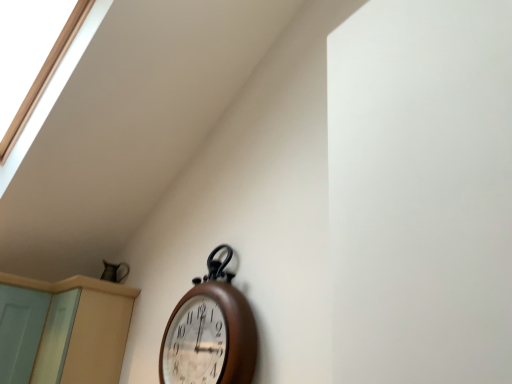
Question: Looking at their shapes, would you say light blue wood screen door at lower left is wider or thinner than beige wood dresser at lower left?

Choices:
 (A) wide
 (B) thin

Answer: (A)

Question: Is point (46, 294) closer or farther from the camera than point (29, 377)?

Choices:
 (A) farther
 (B) closer

Answer: (A)

Question: Based on their relative distances, which object is farther from the beige wood dresser at lower left?

Choices:
 (A) light blue wood screen door at lower left
 (B) wooden wall clock at center

Answer: (B)

Question: Estimate the real-world distances between objects in this image. Which object is farther from the wooden wall clock at center?

Choices:
 (A) light blue wood screen door at lower left
 (B) beige wood dresser at lower left

Answer: (A)